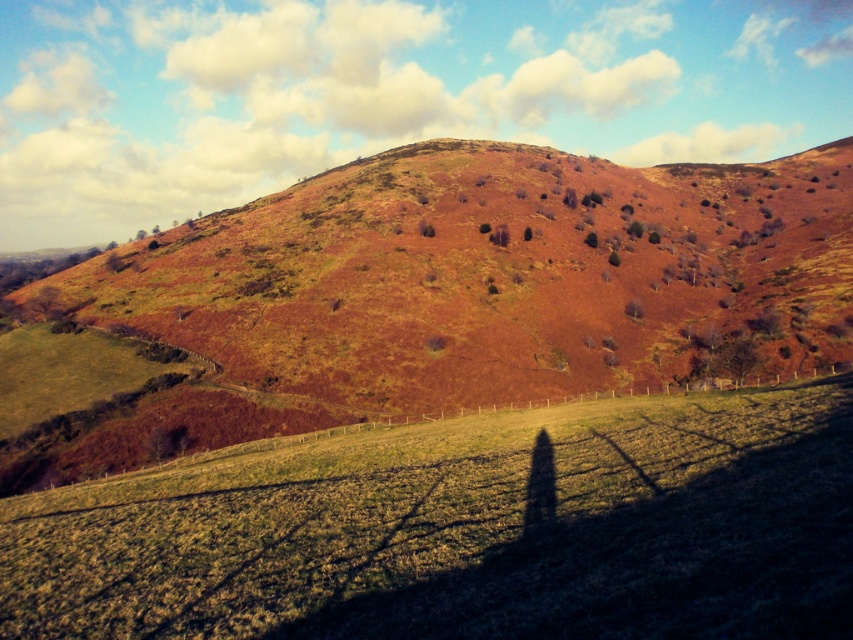
Who is positioned more to the right, green grassy field at lower center or green matte tree at center?

Positioned to the right is green matte tree at center.

Which is in front, point (241, 470) or point (587, 236)?

Point (241, 470)

Does point (788, 428) come closer to viewer compared to point (593, 243)?

That is True.

This screenshot has width=853, height=640. What are the coordinates of `green grassy field at lower center` in the screenshot? It's located at (465, 529).

Between green grassy field at lower center and brown rough tree at upper center, which one appears on the left side from the viewer's perspective?

Positioned to the left is green grassy field at lower center.

Who is more forward, [445,563] or [630,228]?

Point [445,563] is more forward.

What are the coordinates of `green grassy field at lower center` in the screenshot? It's located at (465, 529).

Where is `green grassy field at lower center`? green grassy field at lower center is located at coordinates (465, 529).

Can you confirm if green matte tree at center is smaller than green matte tree at upper center?

Incorrect, green matte tree at center is not smaller in size than green matte tree at upper center.

In the scene shown: Who is more distant from viewer, (590, 234) or (610, 257)?

The point (590, 234) is behind.

What do you see at coordinates (590, 237) in the screenshot? I see `green matte tree at center` at bounding box center [590, 237].

Image resolution: width=853 pixels, height=640 pixels. Find the location of `green matte tree at center`. green matte tree at center is located at coordinates (590, 237).